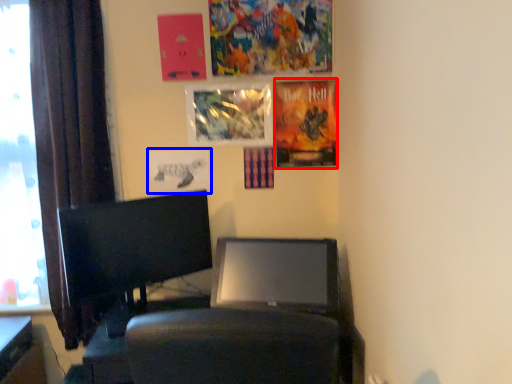
Question: Which object is closer to the camera taking this photo, poster page (highlighted by a red box) or poster page (highlighted by a blue box)?

Choices:
 (A) poster page
 (B) poster page

Answer: (A)